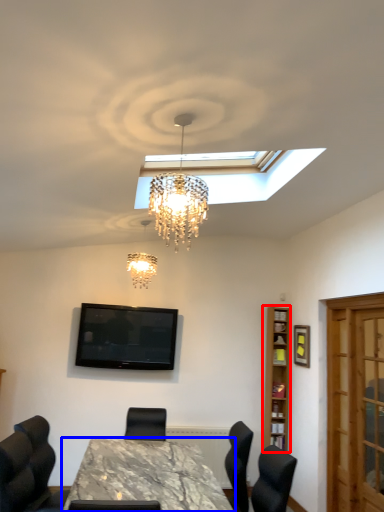
Question: Which point is closer to the camera, bookshelf (highlighted by a red box) or table (highlighted by a blue box)?

Choices:
 (A) bookshelf
 (B) table

Answer: (B)